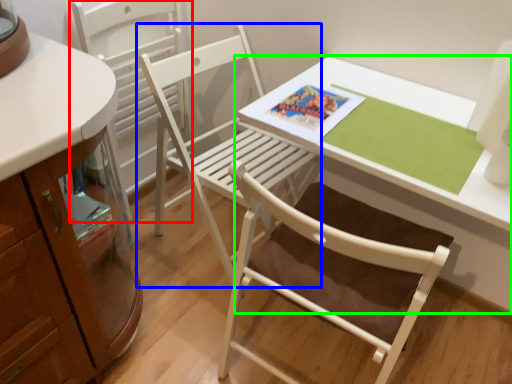
Question: Considering the real-world distances, which object is farthest from chair (highlighted by a red box)? chair (highlighted by a blue box) or table (highlighted by a green box)?

Choices:
 (A) chair
 (B) table

Answer: (B)